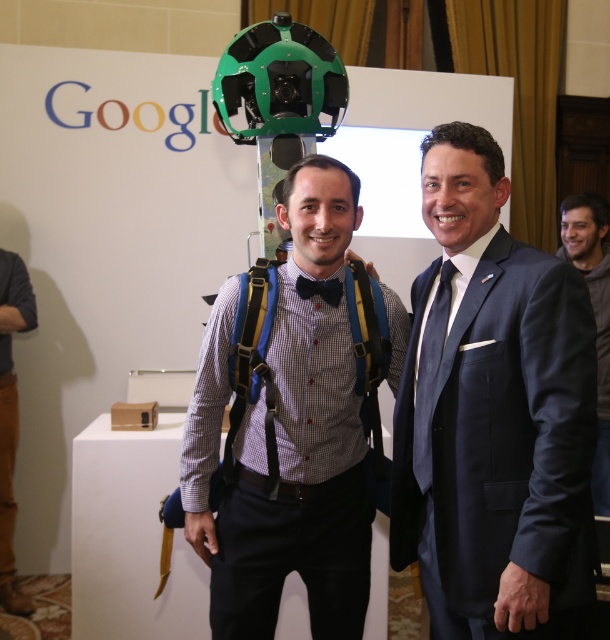
You are a photographer trying to capture a closeup of the checkered fabric shirt at center. The camera can only focus on objects within a 0.1 unit radius around the point at coordinates point (287, 436). Will the checkered fabric shirt at center be in focus?

The point (287, 436) is on the checkered fabric shirt at center, so yes, the checkered fabric shirt at center will be in focus since the camera focuses on that exact point.

You are a fashion designer analyzing the image. You need to decide which item is wider between the blue fabric suspenders at center and the black satin bow tie at center. Which one is wider?

The blue fabric suspenders at center is wider than the black satin bow tie at center according to the description.